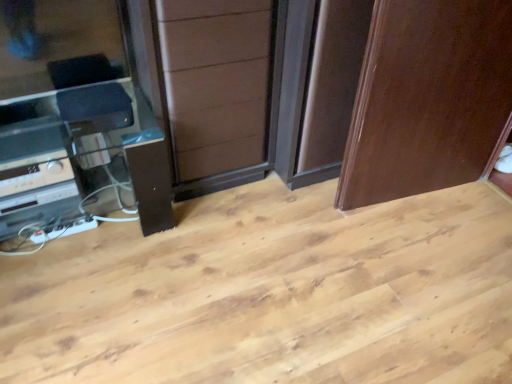
The width and height of the screenshot is (512, 384). Identify the location of free space in front of glossy wood door at upper right. (420, 258).